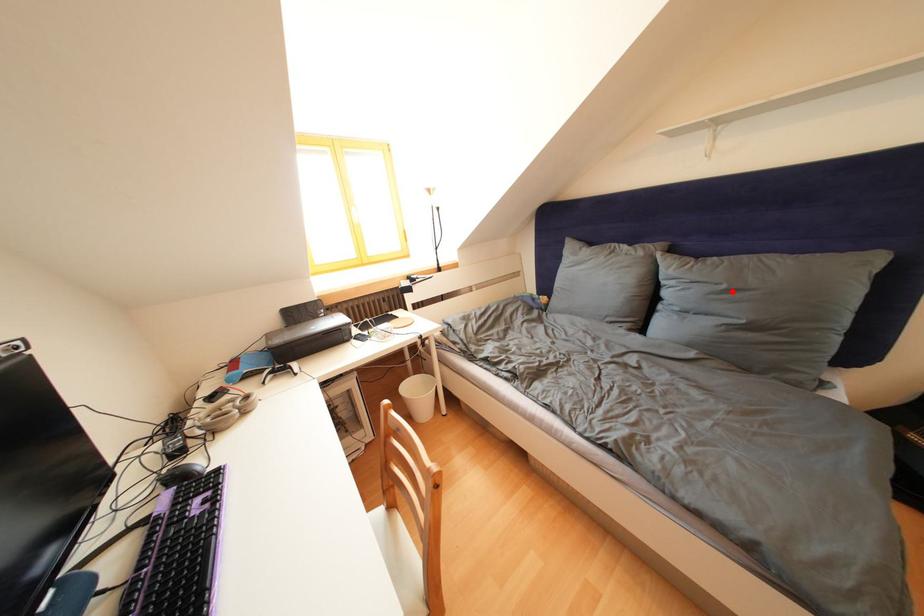
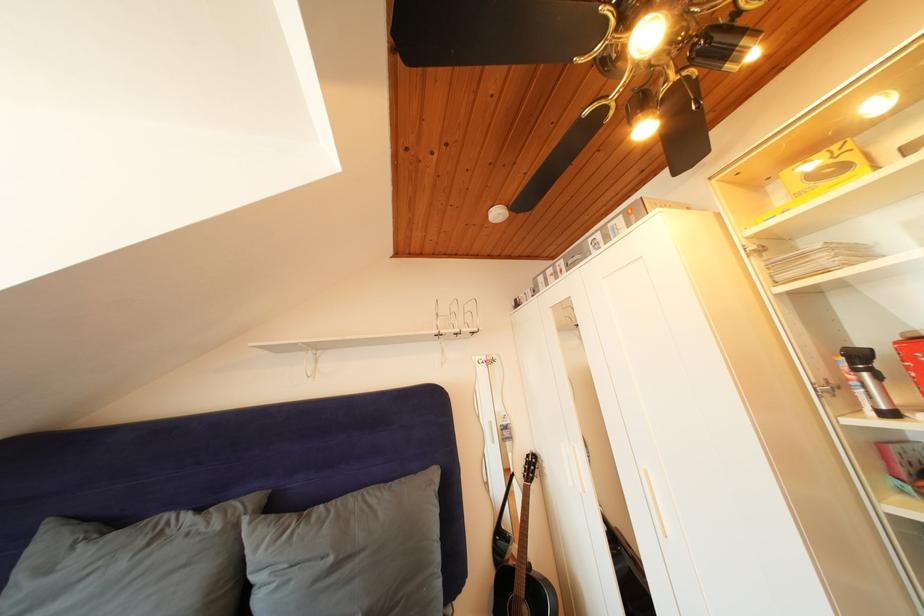
Where in the second image is the point corresponding to the highlighted location from the first image?

(338, 565)